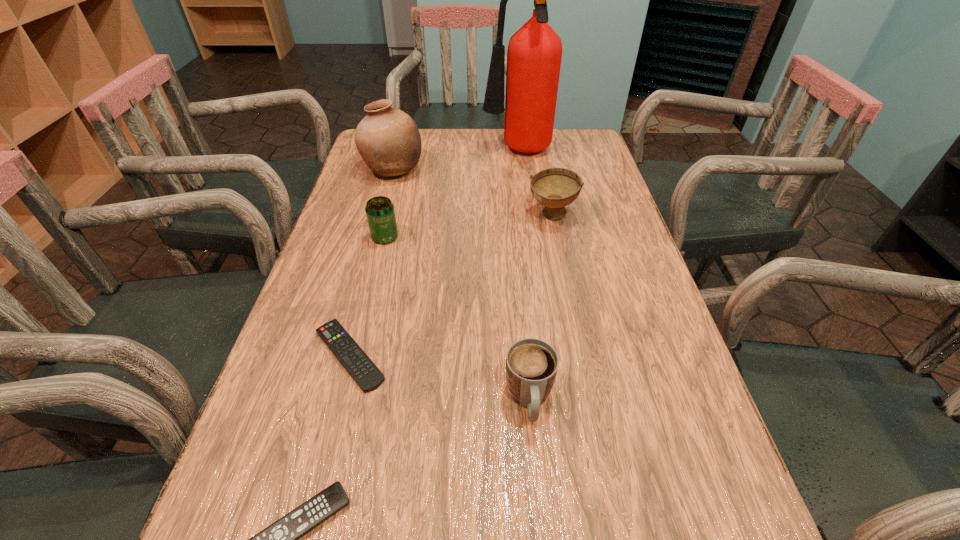
At what (x,y) coordinates should I click in order to perform the action: click on vacant space located 0.320m on the left of the soup bowl. Please return your answer as a coordinate pair (x, y). This screenshot has height=540, width=960. Looking at the image, I should click on (405, 215).

What are the coordinates of `vacant region located on the front of the beer can` in the screenshot? It's located at (378, 265).

What are the coordinates of `vacant space located 0.050m on the side of the mug with the handle` in the screenshot? It's located at (535, 464).

Where is `free location located 0.400m on the back of the farther remote control`? free location located 0.400m on the back of the farther remote control is located at coordinates (388, 207).

The height and width of the screenshot is (540, 960). I want to click on fire extinguisher situated at the far edge, so click(x=534, y=53).

Where is `pottery at the far edge`? This screenshot has width=960, height=540. pottery at the far edge is located at coordinates (388, 140).

Where is `pottery located in the left edge section of the desktop`? The width and height of the screenshot is (960, 540). pottery located in the left edge section of the desktop is located at coordinates (388, 140).

Image resolution: width=960 pixels, height=540 pixels. Identify the location of beer can located in the left edge section of the desktop. (380, 212).

This screenshot has height=540, width=960. In order to click on remote control present at the left edge in this screenshot , I will do `click(360, 367)`.

At what (x,y) coordinates should I click in order to perform the action: click on fire extinguisher at the right edge. Please return your answer as a coordinate pair (x, y). Looking at the image, I should click on (534, 53).